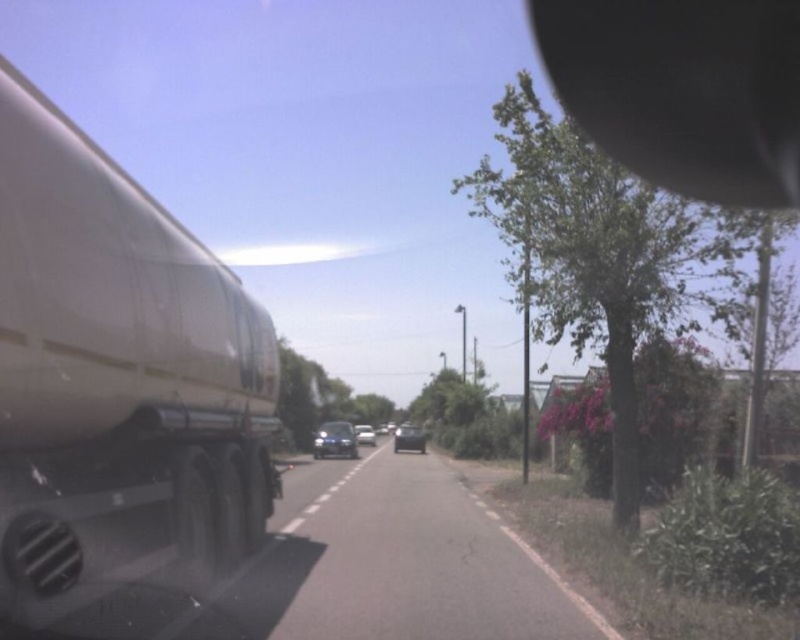
Consider the image. You are a passenger in the car and looking out the window. You notice two points marked on the road ahead. The first point is at coordinates point (534, 33) and the second is at point (424, 444). Which point is closer to your current position?

Point (424, 444) is closer to your current position because it is less further to the camera than point (534, 33).

You are driving a car and notice the black rubber view mirror at upper right and the shiny black sedan at center. Which object is located higher in the image?

The black rubber view mirror at upper right is positioned over the shiny black sedan at center, so it is higher in the image.

You are driving a car and see two points on the road ahead. The first point is at coordinates point (537,3) and the second is at point (354,429). Which point is closer to your current position?

Point (537,3) is closer to the camera than point (354,429), so the first point is closer to your current position.